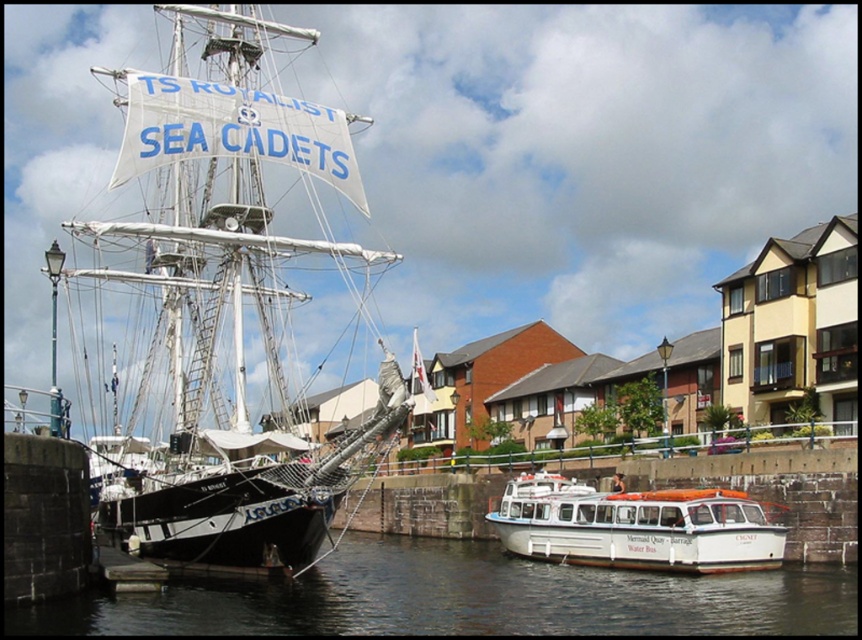
The height and width of the screenshot is (640, 862). What do you see at coordinates (228, 304) in the screenshot?
I see `white canvas sailboat at left` at bounding box center [228, 304].

The width and height of the screenshot is (862, 640). In order to click on white canvas sailboat at left in this screenshot , I will do `click(228, 304)`.

The height and width of the screenshot is (640, 862). I want to click on white canvas sailboat at left, so click(x=228, y=304).

Who is more forward, (x=47, y=632) or (x=540, y=518)?

Point (x=47, y=632) is in front.

Looking at this image, does transparent water at lower center come behind white plastic boat at lower right?

That is False.

Which is behind, point (547, 564) or point (671, 516)?

The point (547, 564) is behind.

Find the location of `transparent water at lower center`. transparent water at lower center is located at coordinates (464, 600).

Based on the photo, is white canvas sailboat at left taller than transparent water at lower center?

Indeed, white canvas sailboat at left has a greater height compared to transparent water at lower center.

Between point (207, 324) and point (282, 586), which one is positioned in front?

Point (282, 586) is more forward.

You are a GUI agent. You are given a task and a screenshot of the screen. Output one action in this format:
    pyautogui.click(x=<x>, y=<y>)
    Task: Click on the white canvas sailboat at left
    This screenshot has height=640, width=862.
    Given the screenshot: What is the action you would take?
    pyautogui.click(x=228, y=304)

Where is `white canvas sailboat at left`? white canvas sailboat at left is located at coordinates (228, 304).